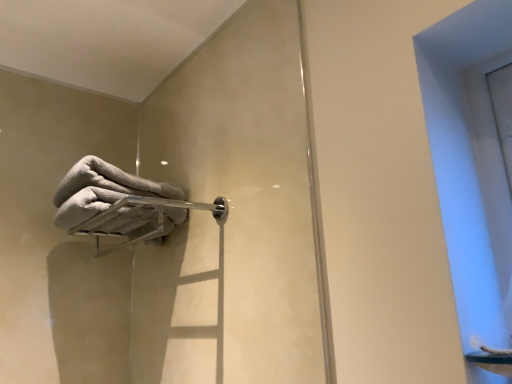
The image size is (512, 384). What do you see at coordinates (157, 220) in the screenshot?
I see `silver metallic towel bar at upper left` at bounding box center [157, 220].

The height and width of the screenshot is (384, 512). I want to click on silver metallic towel bar at upper left, so click(157, 220).

Is transparent glass window at upper right facing away from silver metallic towel bar at upper left?

transparent glass window at upper right is not turned away from silver metallic towel bar at upper left.

Between transparent glass window at upper right and silver metallic towel bar at upper left, which one appears on the left side from the viewer's perspective?

Positioned to the left is silver metallic towel bar at upper left.

From the image's perspective, is transparent glass window at upper right above or below silver metallic towel bar at upper left?

transparent glass window at upper right is situated higher than silver metallic towel bar at upper left in the image.

Is the position of transparent glass window at upper right more distant than that of silver metallic towel bar at upper left?

No, transparent glass window at upper right is in front of silver metallic towel bar at upper left.

Is silver metallic towel bar at upper left placed right next to transparent glass window at upper right?

No, silver metallic towel bar at upper left is not touching transparent glass window at upper right.

Does silver metallic towel bar at upper left have a lesser width compared to transparent glass window at upper right?

In fact, silver metallic towel bar at upper left might be wider than transparent glass window at upper right.

Which is more to the left, silver metallic towel bar at upper left or transparent glass window at upper right?

From the viewer's perspective, silver metallic towel bar at upper left appears more on the left side.

Based on the photo, from a real-world perspective, between white fluffy towel at upper left and silver metallic towel bar at upper left, who is vertically lower?

In real-world perspective, silver metallic towel bar at upper left is lower.

Consider the image. Is white fluffy towel at upper left in contact with silver metallic towel bar at upper left?

Yes, white fluffy towel at upper left and silver metallic towel bar at upper left clearly make contact.

Looking at this image, between white fluffy towel at upper left and silver metallic towel bar at upper left, which one has larger width?

Wider between the two is white fluffy towel at upper left.

Considering the relative sizes of transparent glass window at upper right and white fluffy towel at upper left in the image provided, is transparent glass window at upper right bigger than white fluffy towel at upper left?

Yes.

Considering the relative sizes of transparent glass window at upper right and white fluffy towel at upper left in the image provided, is transparent glass window at upper right taller than white fluffy towel at upper left?

Yes, transparent glass window at upper right is taller than white fluffy towel at upper left.

What's the angular difference between transparent glass window at upper right and white fluffy towel at upper left's facing directions?

The facing directions of transparent glass window at upper right and white fluffy towel at upper left are 11.5 degrees apart.

From the image's perspective, between transparent glass window at upper right and white fluffy towel at upper left, who is located below?

transparent glass window at upper right.

Is silver metallic towel bar at upper left placed right next to white fluffy towel at upper left?

Indeed, silver metallic towel bar at upper left and white fluffy towel at upper left are beside each other and touching.

Which object is wider, silver metallic towel bar at upper left or white fluffy towel at upper left?

With larger width is white fluffy towel at upper left.

From the image's perspective, which object appears higher, silver metallic towel bar at upper left or white fluffy towel at upper left?

white fluffy towel at upper left, from the image's perspective.

Does silver metallic towel bar at upper left have a greater height compared to white fluffy towel at upper left?

In fact, silver metallic towel bar at upper left may be shorter than white fluffy towel at upper left.

From the image's perspective, between white fluffy towel at upper left and transparent glass window at upper right, which one is located above?

white fluffy towel at upper left appears higher in the image.

The width and height of the screenshot is (512, 384). I want to click on towel on the left side of transparent glass window at upper right, so 101,190.

What's the angular difference between white fluffy towel at upper left and transparent glass window at upper right's facing directions?

11.5 degrees separate the facing orientations of white fluffy towel at upper left and transparent glass window at upper right.

Considering the sizes of objects white fluffy towel at upper left and transparent glass window at upper right in the image provided, who is thinner, white fluffy towel at upper left or transparent glass window at upper right?

transparent glass window at upper right.

The image size is (512, 384). I want to click on window located in front of the silver metallic towel bar at upper left, so click(469, 157).

This screenshot has width=512, height=384. In order to click on towel bar above the transparent glass window at upper right (from a real-world perspective) in this screenshot , I will do `click(157, 220)`.

When comparing their distances from white fluffy towel at upper left, does silver metallic towel bar at upper left or transparent glass window at upper right seem closer?

silver metallic towel bar at upper left lies closer to white fluffy towel at upper left than the other object.

Looking at the image, which one is located closer to transparent glass window at upper right, white fluffy towel at upper left or silver metallic towel bar at upper left?

silver metallic towel bar at upper left is closer to transparent glass window at upper right.

Which object lies further to the anchor point silver metallic towel bar at upper left, white fluffy towel at upper left or transparent glass window at upper right?

transparent glass window at upper right lies further to silver metallic towel bar at upper left than the other object.

Estimate the real-world distances between objects in this image. Which object is closer to silver metallic towel bar at upper left, transparent glass window at upper right or white fluffy towel at upper left?

white fluffy towel at upper left is positioned closer to the anchor silver metallic towel bar at upper left.

Based on the photo, from the image, which object appears to be nearer to white fluffy towel at upper left, transparent glass window at upper right or silver metallic towel bar at upper left?

Among the two, silver metallic towel bar at upper left is located nearer to white fluffy towel at upper left.

When comparing their distances from transparent glass window at upper right, does silver metallic towel bar at upper left or white fluffy towel at upper left seem further?

white fluffy towel at upper left is further to transparent glass window at upper right.

Where is `towel bar situated between white fluffy towel at upper left and transparent glass window at upper right from left to right`? towel bar situated between white fluffy towel at upper left and transparent glass window at upper right from left to right is located at coordinates (157, 220).